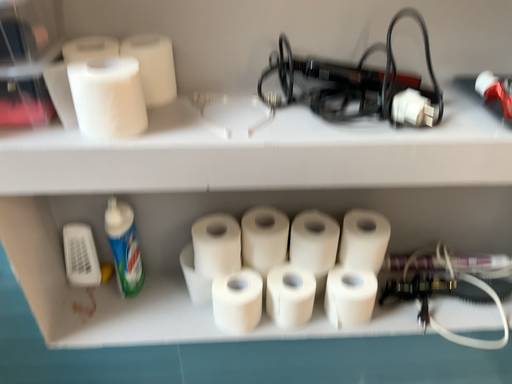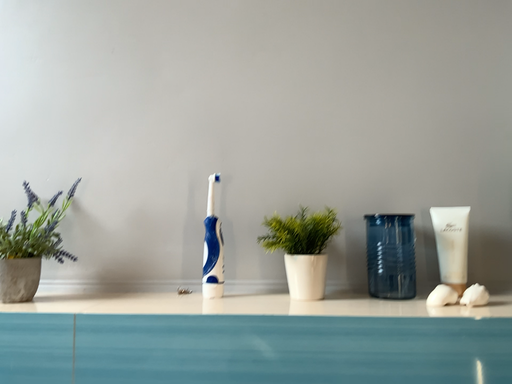
Question: How did the camera likely rotate when shooting the video?

Choices:
 (A) rotated upward
 (B) rotated downward

Answer: (A)